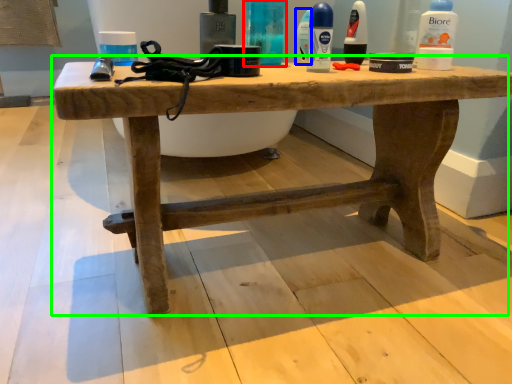
Question: Estimate the real-world distances between objects in this image. Which object is closer to toiletry (highlighted by a red box), mouthwash (highlighted by a blue box) or table (highlighted by a green box)?

Choices:
 (A) mouthwash
 (B) table

Answer: (A)